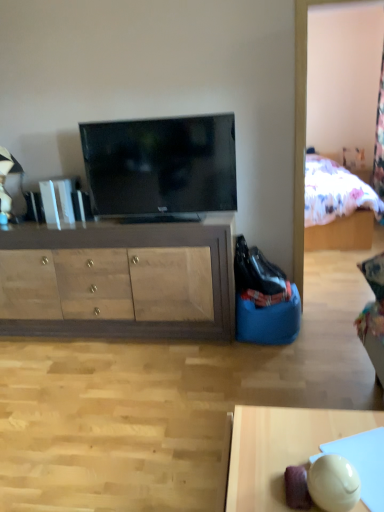
Question: Is smooth wooden desk at lower right to the left of wooden cabinet at center from the viewer's perspective?

Choices:
 (A) yes
 (B) no

Answer: (B)

Question: Can you confirm if smooth wooden desk at lower right is thinner than wooden cabinet at center?

Choices:
 (A) yes
 (B) no

Answer: (A)

Question: From a real-world perspective, is smooth wooden desk at lower right located higher than wooden cabinet at center?

Choices:
 (A) yes
 (B) no

Answer: (B)

Question: Is smooth wooden desk at lower right looking in the opposite direction of wooden cabinet at center?

Choices:
 (A) no
 (B) yes

Answer: (A)

Question: Considering the relative sizes of smooth wooden desk at lower right and wooden cabinet at center in the image provided, is smooth wooden desk at lower right bigger than wooden cabinet at center?

Choices:
 (A) yes
 (B) no

Answer: (B)

Question: From a real-world perspective, does smooth wooden desk at lower right sit lower than wooden cabinet at center?

Choices:
 (A) no
 (B) yes

Answer: (B)

Question: Does matte black tv at center contain wooden cabinet at center?

Choices:
 (A) yes
 (B) no

Answer: (B)

Question: Does matte black tv at center appear on the right side of wooden cabinet at center?

Choices:
 (A) yes
 (B) no

Answer: (A)

Question: Considering the relative sizes of matte black tv at center and wooden cabinet at center in the image provided, is matte black tv at center smaller than wooden cabinet at center?

Choices:
 (A) no
 (B) yes

Answer: (B)

Question: Is matte black tv at center not close to wooden cabinet at center?

Choices:
 (A) no
 (B) yes

Answer: (A)

Question: From the image's perspective, is matte black tv at center on wooden cabinet at center?

Choices:
 (A) no
 (B) yes

Answer: (B)

Question: Could you tell me if matte black tv at center is facing wooden cabinet at center?

Choices:
 (A) no
 (B) yes

Answer: (A)

Question: Is wooden cabinet at center at the right side of smooth wooden desk at lower right?

Choices:
 (A) yes
 (B) no

Answer: (B)